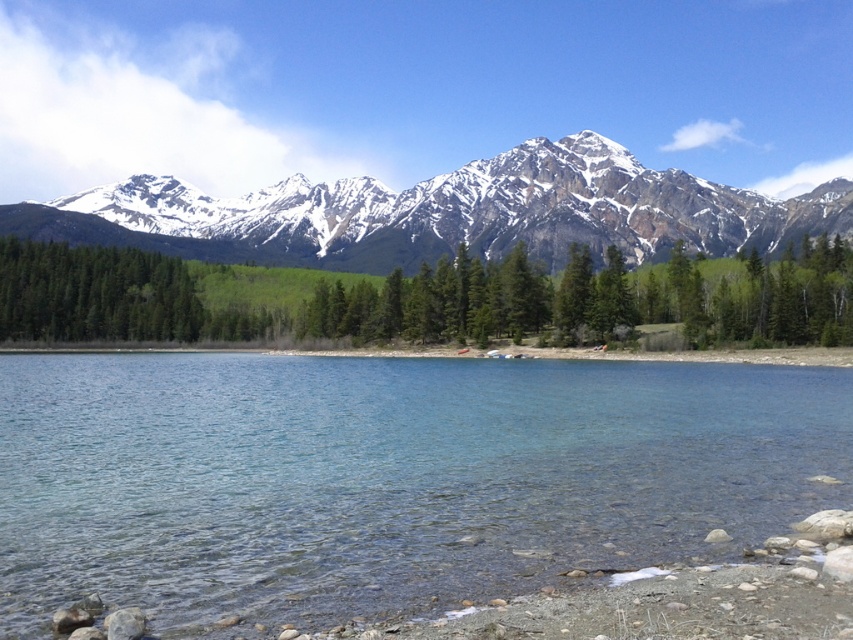
Question: Estimate the real-world distances between objects in this image. Which object is closer to the green matte trees at center?

Choices:
 (A) snowy granite mountain range at upper center
 (B) clear glass water at center

Answer: (B)

Question: Is clear glass water at center in front of snowy granite mountain range at upper center?

Choices:
 (A) yes
 (B) no

Answer: (A)

Question: Is clear glass water at center below snowy granite mountain range at upper center?

Choices:
 (A) no
 (B) yes

Answer: (B)

Question: Which object is positioned farthest from the snowy granite mountain range at upper center?

Choices:
 (A) clear glass water at center
 (B) green matte trees at center

Answer: (A)

Question: Which object appears farthest from the camera in this image?

Choices:
 (A) green matte trees at center
 (B) clear glass water at center
 (C) snowy granite mountain range at upper center

Answer: (C)

Question: Is snowy granite mountain range at upper center to the right of green matte trees at center from the viewer's perspective?

Choices:
 (A) no
 (B) yes

Answer: (A)